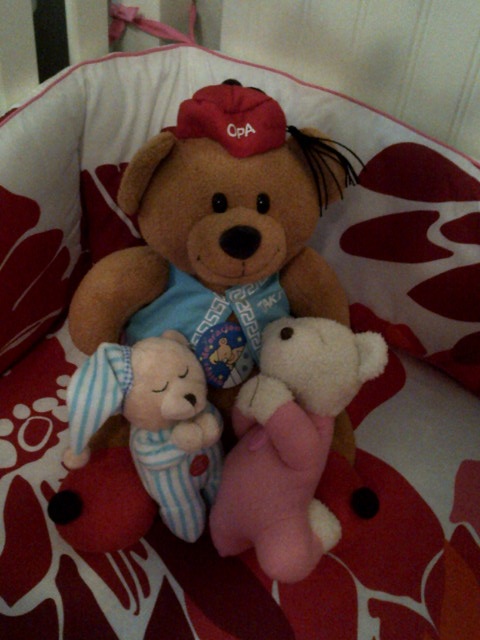
The height and width of the screenshot is (640, 480). In order to click on stuffed toys in this screenshot , I will do `click(264, 458)`, `click(151, 452)`, `click(236, 276)`.